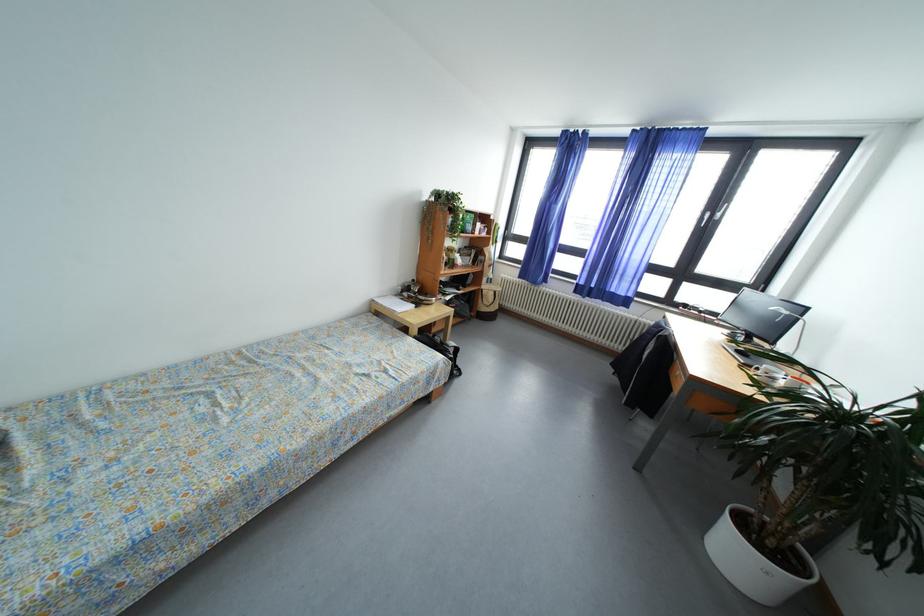
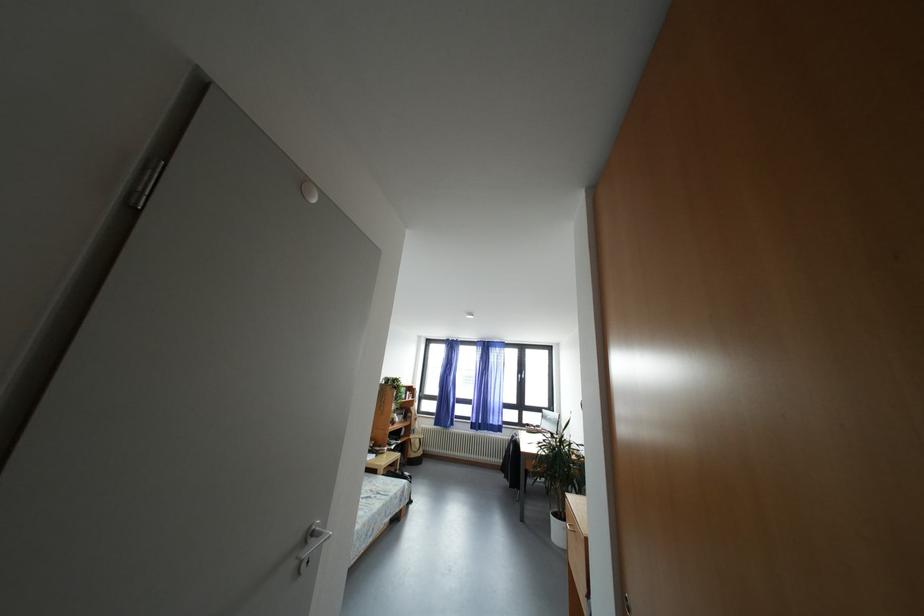
Locate, in the second image, the point that corresponds to point (749, 530) in the first image.

(562, 519)